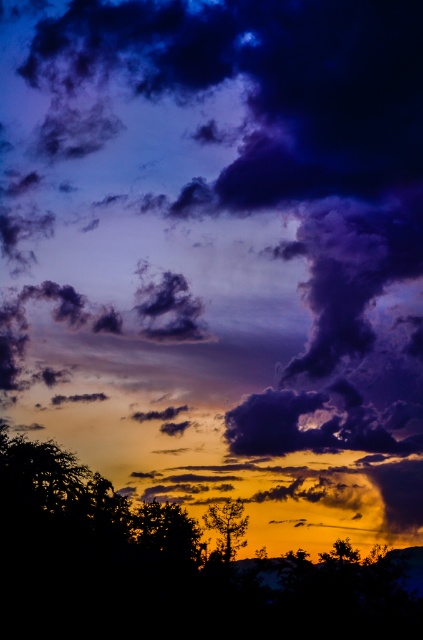
You are standing in a field and see the silhouette leafy tree at lower center in the distance. If you want to take a photo of it with your phone camera, which has a maximum zoom range of 10 meters, will you be able to capture the entire tree without moving closer?

The silhouette leafy tree at lower center is 54.46 meters away from you. Since your phone camera has a maximum zoom range of 10 meters, you will not be able to capture the entire tree without moving closer because the distance is much greater than the zoom capability.